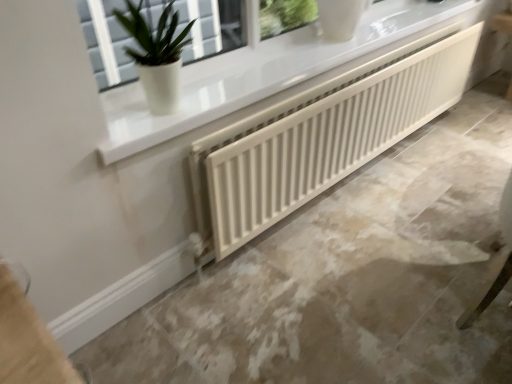
Question: From their relative heights in the image, would you say green matte plant at upper left is taller or shorter than white ribbed radiator at center?

Choices:
 (A) short
 (B) tall

Answer: (A)

Question: Which is correct: green matte plant at upper left is inside white ribbed radiator at center, or outside of it?

Choices:
 (A) inside
 (B) outside

Answer: (B)

Question: Estimate the real-world distances between objects in this image. Which object is farther from the white ribbed radiator at center?

Choices:
 (A) green matte plant at upper left
 (B) white matte radiator at center

Answer: (A)

Question: Which object is the closest to the green matte plant at upper left?

Choices:
 (A) white ribbed radiator at center
 (B) white matte radiator at center

Answer: (A)